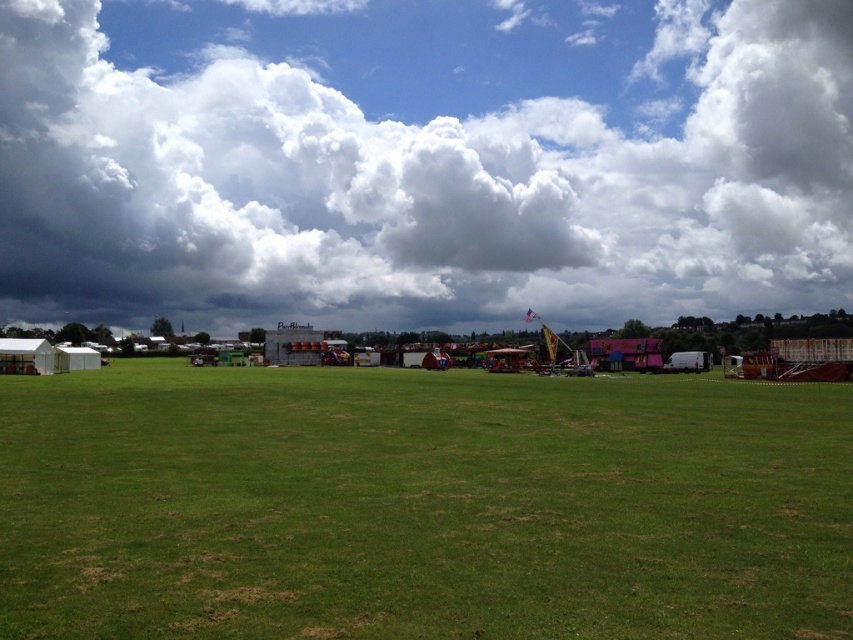
You are standing in the open grassy field and want to look up at the cloudy sky at upper center. What coordinates should you look towards?

You should look towards the coordinates point at [422,161] to see the cloudy sky at upper center.